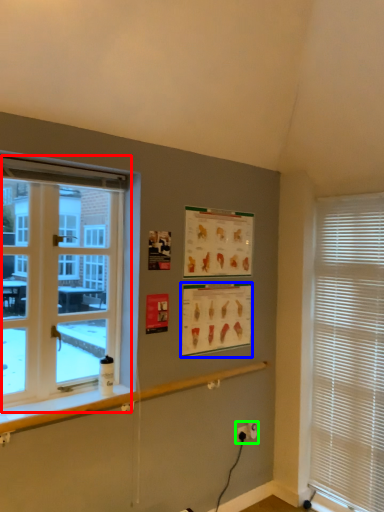
Question: Based on their relative distances, which object is nearer to window (highlighted by a red box)? Choose from poster page (highlighted by a blue box) and electric outlet (highlighted by a green box).

Choices:
 (A) poster page
 (B) electric outlet

Answer: (A)